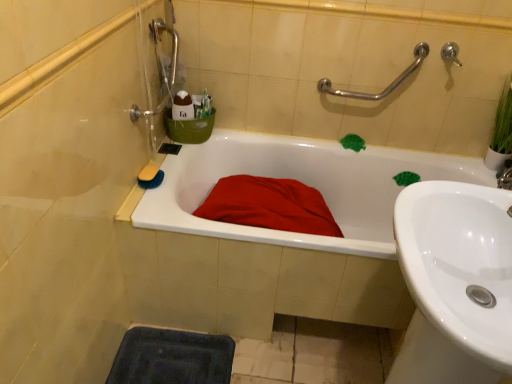
Question: Is silver metallic faucet at upper right at the right side of white glossy bathtub at center?

Choices:
 (A) no
 (B) yes

Answer: (B)

Question: Can you see silver metallic faucet at upper right touching white glossy bathtub at center?

Choices:
 (A) no
 (B) yes

Answer: (A)

Question: Does silver metallic faucet at upper right have a greater height compared to white glossy bathtub at center?

Choices:
 (A) yes
 (B) no

Answer: (B)

Question: Is silver metallic faucet at upper right shorter than white glossy bathtub at center?

Choices:
 (A) yes
 (B) no

Answer: (A)

Question: Is silver metallic faucet at upper right facing away from white glossy bathtub at center?

Choices:
 (A) yes
 (B) no

Answer: (B)

Question: In the image, is matte red blanket at center on the left side or the right side of silver metallic faucet at upper right?

Choices:
 (A) left
 (B) right

Answer: (A)

Question: Based on their sizes in the image, would you say matte red blanket at center is bigger or smaller than silver metallic faucet at upper right?

Choices:
 (A) small
 (B) big

Answer: (B)

Question: Is matte red blanket at center in front of or behind silver metallic faucet at upper right in the image?

Choices:
 (A) front
 (B) behind

Answer: (A)

Question: From the image's perspective, is matte red blanket at center positioned above or below silver metallic faucet at upper right?

Choices:
 (A) above
 (B) below

Answer: (B)

Question: From a real-world perspective, is white glossy sink at lower right positioned above or below dark blue rubber bath mat at lower left?

Choices:
 (A) above
 (B) below

Answer: (A)

Question: Based on their positions, is white glossy sink at lower right located to the left or right of dark blue rubber bath mat at lower left?

Choices:
 (A) left
 (B) right

Answer: (B)

Question: From their relative heights in the image, would you say white glossy sink at lower right is taller or shorter than dark blue rubber bath mat at lower left?

Choices:
 (A) short
 (B) tall

Answer: (B)

Question: Considering the positions of white glossy sink at lower right and dark blue rubber bath mat at lower left in the image, is white glossy sink at lower right wider or thinner than dark blue rubber bath mat at lower left?

Choices:
 (A) thin
 (B) wide

Answer: (B)

Question: In terms of size, does silver metallic faucet at upper right appear bigger or smaller than dark blue rubber bath mat at lower left?

Choices:
 (A) big
 (B) small

Answer: (B)

Question: Based on their positions, is silver metallic faucet at upper right located to the left or right of dark blue rubber bath mat at lower left?

Choices:
 (A) left
 (B) right

Answer: (B)